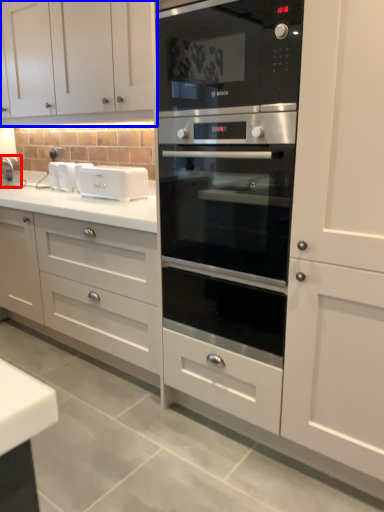
Question: Among these objects, which one is farthest to the camera, faucet (highlighted by a red box) or cabinetry (highlighted by a blue box)?

Choices:
 (A) faucet
 (B) cabinetry

Answer: (A)